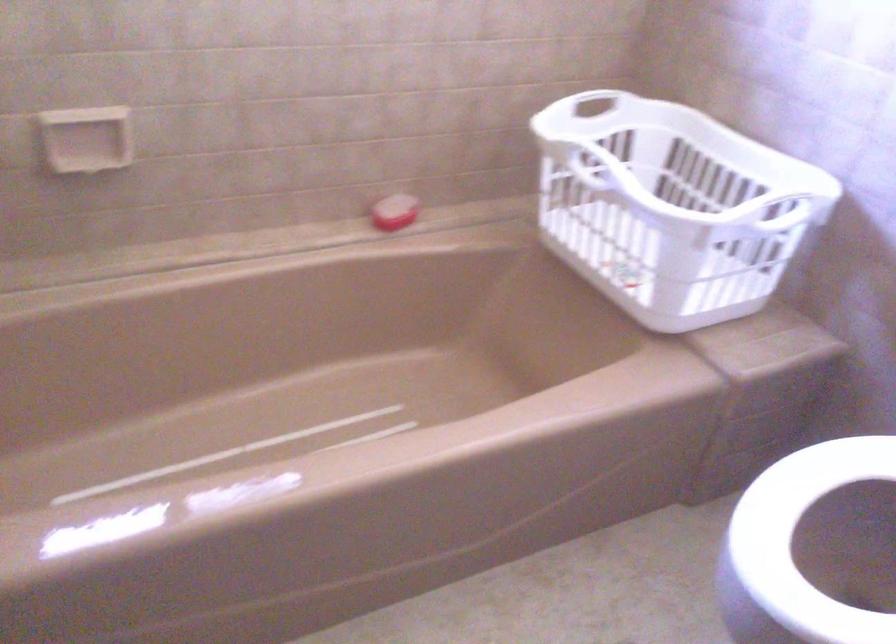
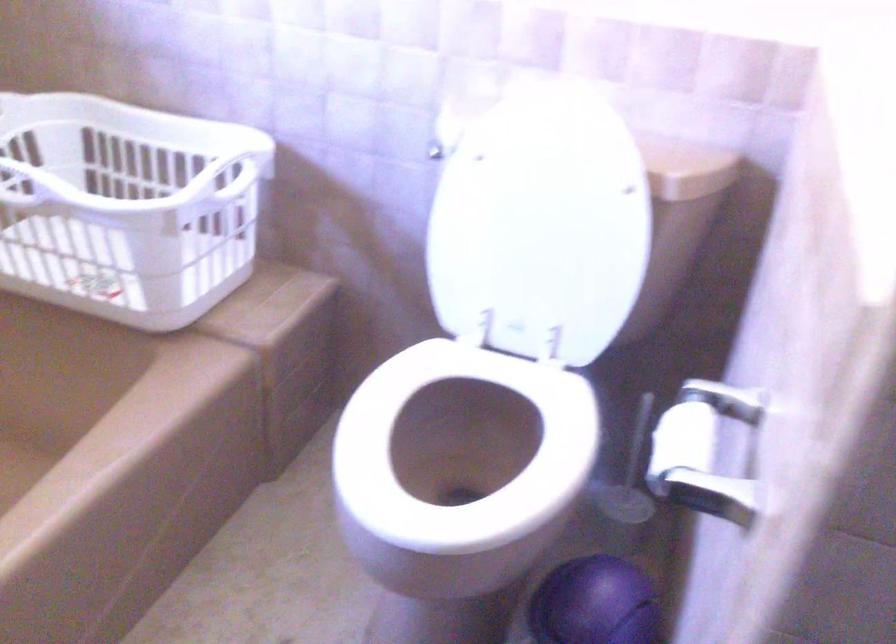
The point at (x=776, y=207) is marked in the first image. Where is the corresponding point in the second image?

(222, 178)